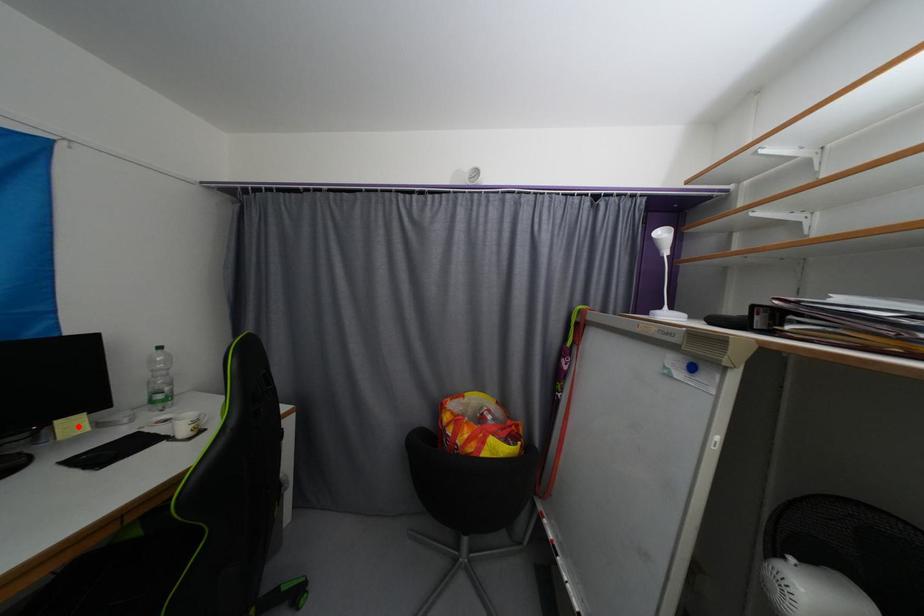
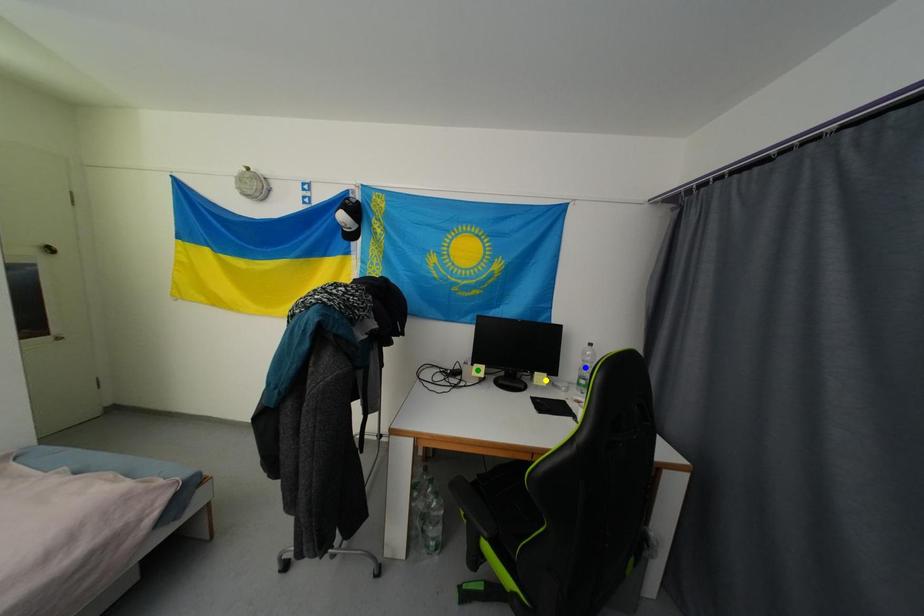
Question: I am providing you with two images of the same scene from different viewpoints. A red point is marked on the first image. You are given multiple points on the second image. Which point in image 2 is actually the same real-world point as the red point in image 1?

Choices:
 (A) blue point
 (B) yellow point
 (C) green point

Answer: (B)